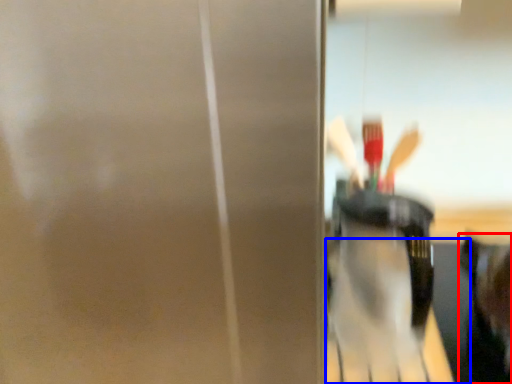
Question: Which object appears closest to the camera in this image, person (highlighted by a red box) or table (highlighted by a blue box)?

Choices:
 (A) person
 (B) table

Answer: (A)